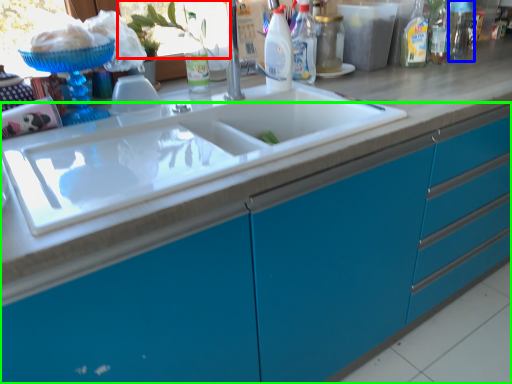
Question: Which is farther away from window screen (highlighted by a red box)? bottle (highlighted by a blue box) or cabinetry (highlighted by a green box)?

Choices:
 (A) bottle
 (B) cabinetry

Answer: (A)